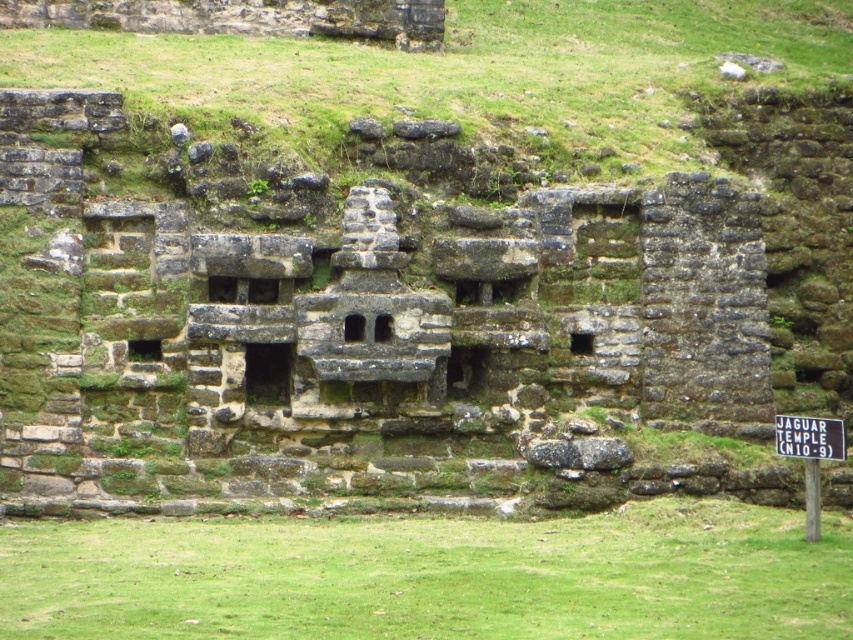
You are standing in front of the ancient stone structure and notice two points marked on the wall. The first point is at coordinates point (503, 36) and the second is at point (793, 438). Which point is closer to you?

Point (503, 36) is closer to you because it is further to the viewer than point (793, 438).

You are standing in front of the ancient stone structure and want to determine the relative positions of two points marked on the structure. Which point, point (228, 636) or point (792, 417), is closer to you?

Point (228, 636) is closer to the viewer than point (792, 417).